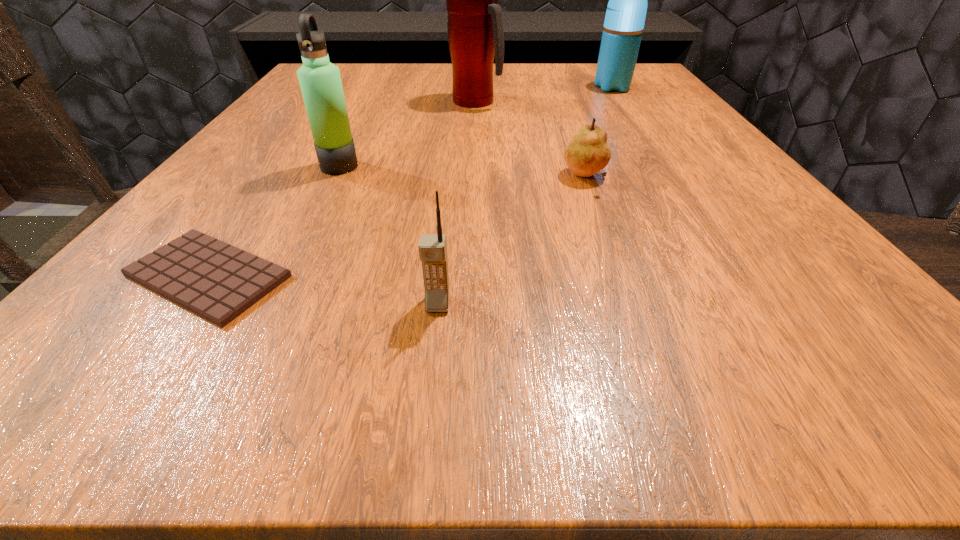
This screenshot has height=540, width=960. I want to click on vacant region at the left edge of the desktop, so click(242, 167).

Where is `blank area at the right edge`? blank area at the right edge is located at coordinates (676, 108).

The image size is (960, 540). In the image, there is a desktop. Find the location of `vacant space at the far left corner`. vacant space at the far left corner is located at coordinates (345, 66).

Locate an element on the screen. This screenshot has height=540, width=960. vacant space at the near left corner of the desktop is located at coordinates (128, 323).

Locate an element on the screen. vacant area that lies between the cellular telephone and the shortest object is located at coordinates (323, 290).

Find the location of a particular element. Image resolution: width=960 pixels, height=540 pixels. vacant area that lies between the third shortest object and the leftmost thermos bottle is located at coordinates (389, 235).

This screenshot has width=960, height=540. What are the coordinates of `empty location between the rightmost thermos bottle and the leftmost thermos bottle` in the screenshot? It's located at (476, 127).

Identify the location of blank region between the second thermos bottle from left to right and the rightmost object. (544, 94).

Where is `vacant region between the fifth tallest object and the nearest thermos bottle`? vacant region between the fifth tallest object and the nearest thermos bottle is located at coordinates (463, 173).

Locate an element on the screen. The width and height of the screenshot is (960, 540). empty space that is in between the leftmost thermos bottle and the third shortest object is located at coordinates (389, 235).